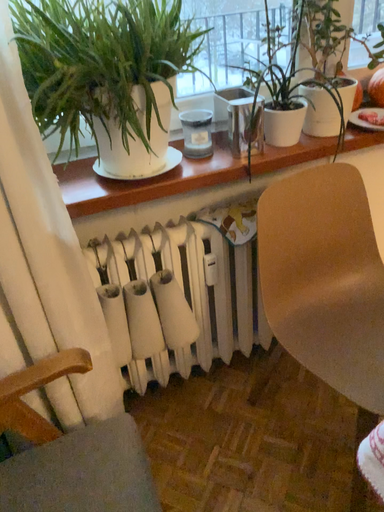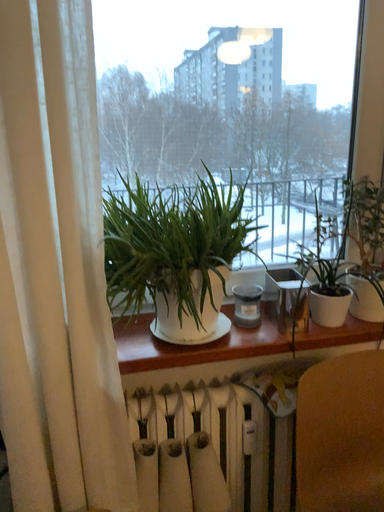
Question: How did the camera likely rotate when shooting the video?

Choices:
 (A) rotated downward
 (B) rotated upward

Answer: (B)